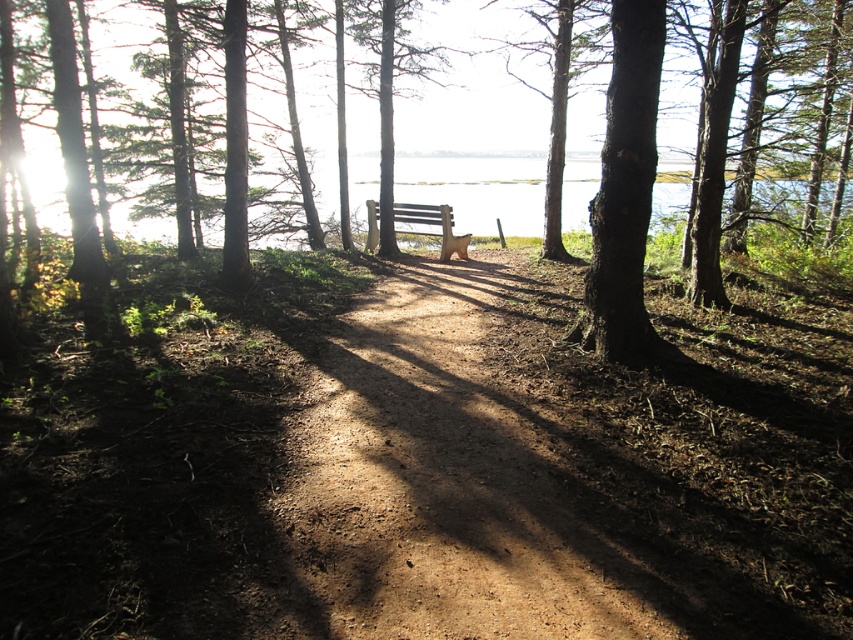
Which is above, dirt path at center or brown wooden bench at center?

brown wooden bench at center is higher up.

Between point (376, 563) and point (465, 234), which one is positioned behind?

The point (465, 234) is behind.

What are the coordinates of `dirt path at center` in the screenshot? It's located at (450, 481).